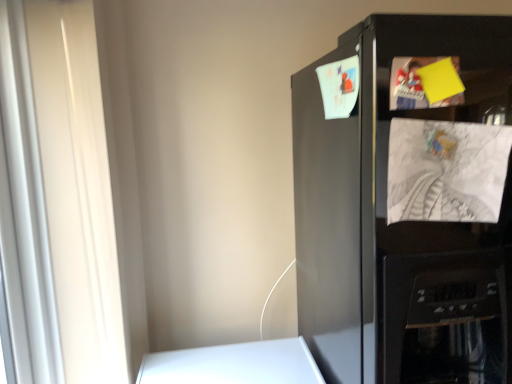
Question: Can you confirm if white textured paper at right is taller than black matte refrigerator at upper right?

Choices:
 (A) yes
 (B) no

Answer: (B)

Question: Does white textured paper at right have a lesser height compared to black matte refrigerator at upper right?

Choices:
 (A) yes
 (B) no

Answer: (A)

Question: From a real-world perspective, is white textured paper at right on black matte refrigerator at upper right?

Choices:
 (A) no
 (B) yes

Answer: (B)

Question: Is the depth of white textured paper at right less than that of black matte refrigerator at upper right?

Choices:
 (A) no
 (B) yes

Answer: (A)

Question: Does white textured paper at right have a smaller size compared to black matte refrigerator at upper right?

Choices:
 (A) yes
 (B) no

Answer: (A)

Question: Can you confirm if white textured paper at right is positioned to the right of black matte refrigerator at upper right?

Choices:
 (A) no
 (B) yes

Answer: (A)

Question: Considering the relative sizes of black matte refrigerator at upper right and white textured paper at right in the image provided, is black matte refrigerator at upper right bigger than white textured paper at right?

Choices:
 (A) yes
 (B) no

Answer: (A)

Question: Does black matte refrigerator at upper right have a greater height compared to white textured paper at right?

Choices:
 (A) no
 (B) yes

Answer: (B)

Question: Does black matte refrigerator at upper right turn towards white textured paper at right?

Choices:
 (A) no
 (B) yes

Answer: (B)

Question: Is black matte refrigerator at upper right outside white textured paper at right?

Choices:
 (A) no
 (B) yes

Answer: (B)

Question: From a real-world perspective, is black matte refrigerator at upper right positioned over white textured paper at right based on gravity?

Choices:
 (A) no
 (B) yes

Answer: (A)

Question: From the image's perspective, is black matte refrigerator at upper right beneath white textured paper at right?

Choices:
 (A) no
 (B) yes

Answer: (B)

Question: Considering the positions of point (486, 142) and point (401, 223), is point (486, 142) closer or farther from the camera than point (401, 223)?

Choices:
 (A) closer
 (B) farther

Answer: (A)